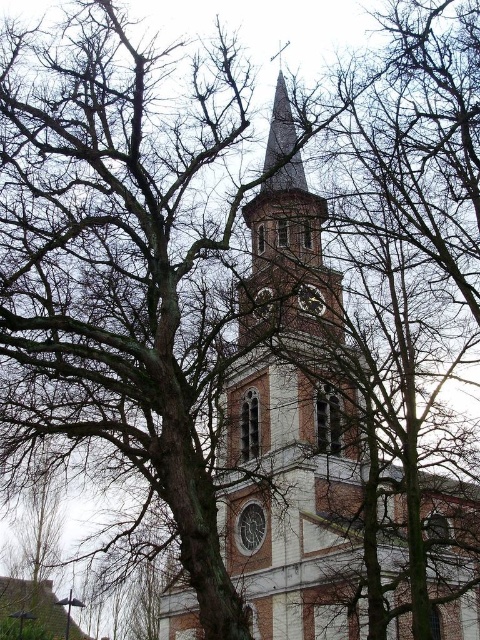
Does point (308, 300) come behind point (255, 310)?

Yes, it is behind point (255, 310).

Who is taller, metallic silver clock at center or metallic clock at center?

metallic clock at center is taller.

Which is behind, point (301, 291) or point (265, 296)?

The point (265, 296) is more distant.

Find the location of a particular element. metallic silver clock at center is located at coordinates (311, 300).